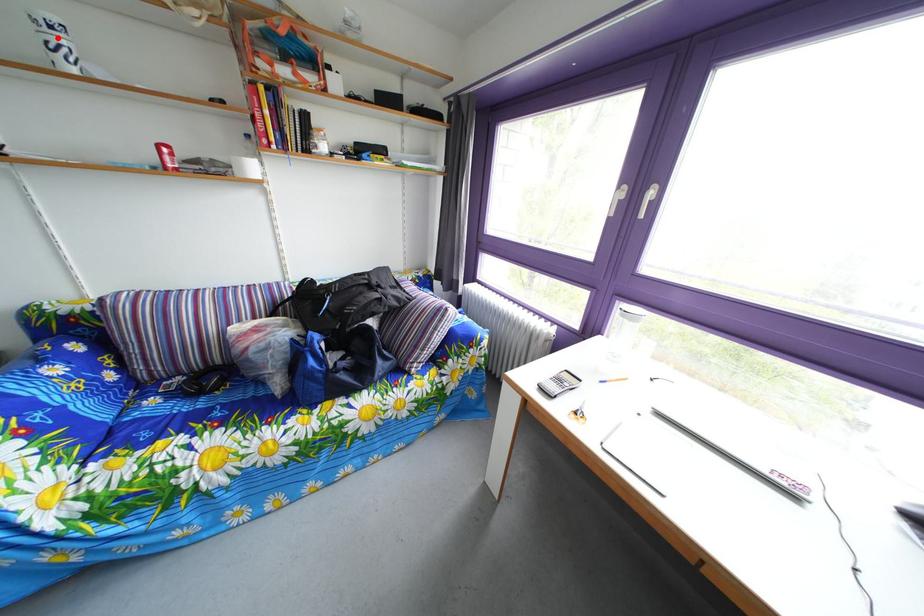
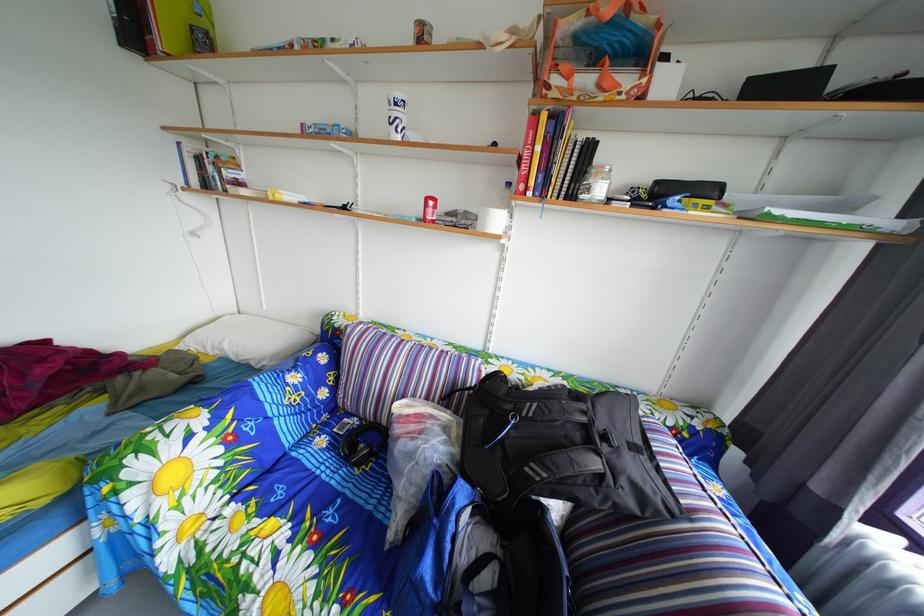
Question: I am providing you with two images of the same scene from different viewpoints. A red point is shown in image1. For the corresponding object point in image2, is it positioned nearer or farther from the camera?

Choices:
 (A) Nearer
 (B) Farther

Answer: (A)